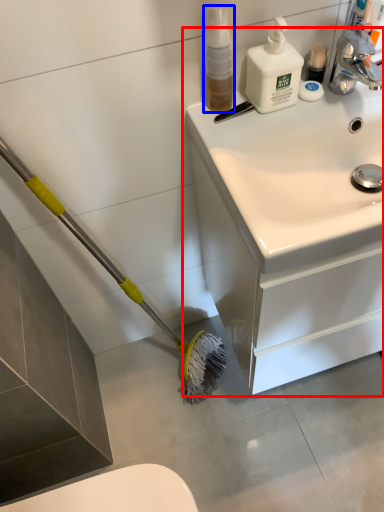
Question: Which point is closer to the camera, bathroom cabinet (highlighted by a red box) or cleaning product (highlighted by a blue box)?

Choices:
 (A) bathroom cabinet
 (B) cleaning product

Answer: (A)